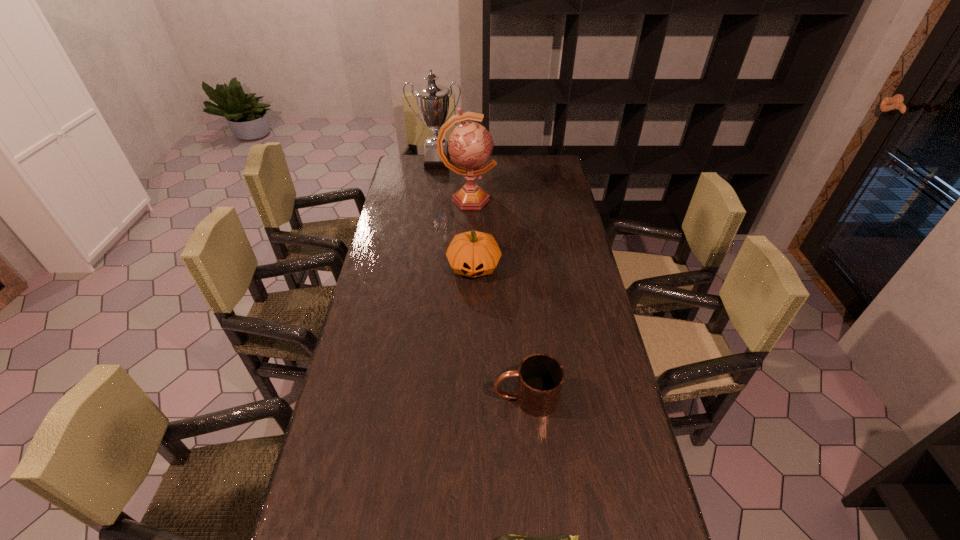
Find the location of `the farthest object`. the farthest object is located at coordinates (432, 100).

Locate an element on the screen. the fourth nearest object is located at coordinates (470, 144).

Locate an element on the screen. This screenshot has height=540, width=960. gourd is located at coordinates (473, 254).

I want to click on the third nearest object, so click(x=473, y=254).

You are a GUI agent. You are given a task and a screenshot of the screen. Output one action in this format:
    pyautogui.click(x=<x>, y=<y>)
    Task: Click on the mug
    
    Given the screenshot: What is the action you would take?
    pyautogui.click(x=540, y=379)

The width and height of the screenshot is (960, 540). I want to click on the fourth farthest object, so (540, 379).

Where is `free space located at the front view of the trophy cup`? Image resolution: width=960 pixels, height=540 pixels. free space located at the front view of the trophy cup is located at coordinates (434, 183).

In order to click on free region located on the front-facing side of the fourth nearest object in this screenshot , I will do `click(551, 200)`.

The image size is (960, 540). Identify the location of vacant region located on the side of the third farthest object with the carved face. (472, 386).

This screenshot has height=540, width=960. Find the location of `vacant space located 0.100m on the side of the second nearest object with the handle`. vacant space located 0.100m on the side of the second nearest object with the handle is located at coordinates [457, 397].